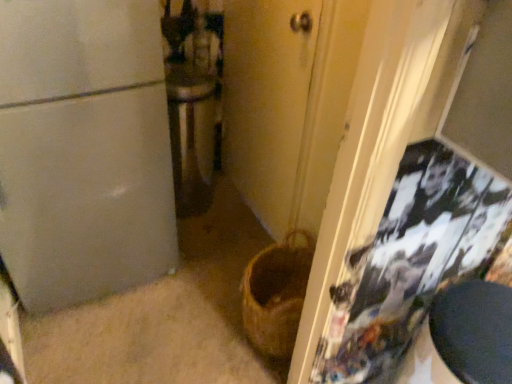
What do you see at coordinates (191, 137) in the screenshot? I see `metallic cylindrical object at center-left` at bounding box center [191, 137].

This screenshot has width=512, height=384. I want to click on metallic cylindrical object at center-left, so click(x=191, y=137).

I want to click on metallic cylindrical object at center-left, so click(191, 137).